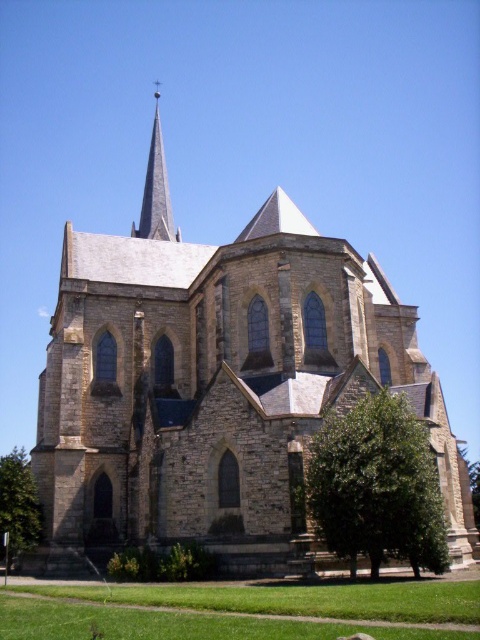
You are standing on the lawn in front of the church and want to take a photo of the smooth gray steeple at upper center without the green leafy tree at lower left blocking the view. Which direction should you move to ensure the tree is out of the frame?

Move to the right side of the lawn. Since the green leafy tree at lower left is to the left of the smooth gray steeple at upper center, moving right will position the tree out of the frame while keeping the steeple in view.

You are standing in front of the church and want to take a photo of the smooth gray steeple at upper center without the green leafy tree at lower right blocking the view. Is the tree in the way?

The green leafy tree at lower right is closer to the viewer than the smooth gray steeple at upper center, so the tree will block the view of the steeple in the photo.